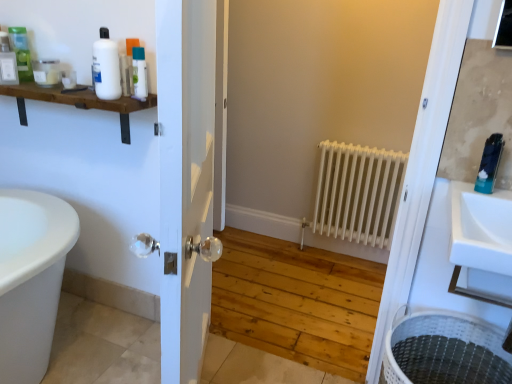
Identify the location of vacant region below white matte shelf at upper left (from a real-world perspective). [96, 318].